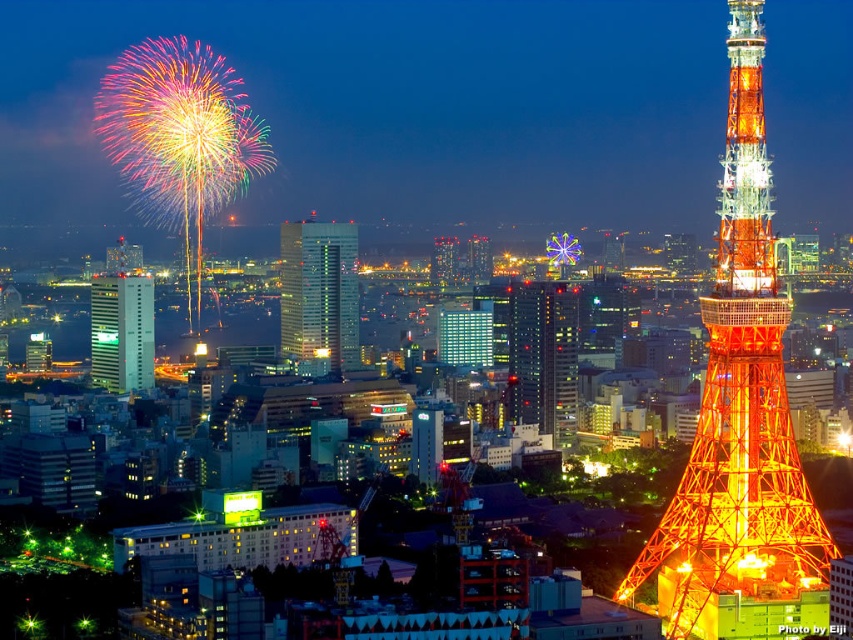
You are standing in the city and want to take a photo of both the shiny orange tower at right and the shiny glass skyscraper at center. Which object should you focus on first to ensure both are in the frame?

You should focus on the shiny glass skyscraper at center first because it is closer to the viewer than the shiny orange tower at right, allowing you to frame both properly.

Looking at this image, you are standing in the city and want to take a photo of both the shiny orange tower at right and the green glass building at center. Which object should you position to your left to include both in the frame?

You should position the green glass building at center to your left since the shiny orange tower at right is to the right of it, so placing the green glass building at center on your left will allow both to be in the frame.

You are standing in the city square looking at the Tokyo Tower and the fireworks. There are two points marked on the image. One is at coordinate point (793, 515) and the other is at coordinate point (137, 372). Which point is closer to you?

Point (137, 372) is closer to you because it is less further than point (793, 515).